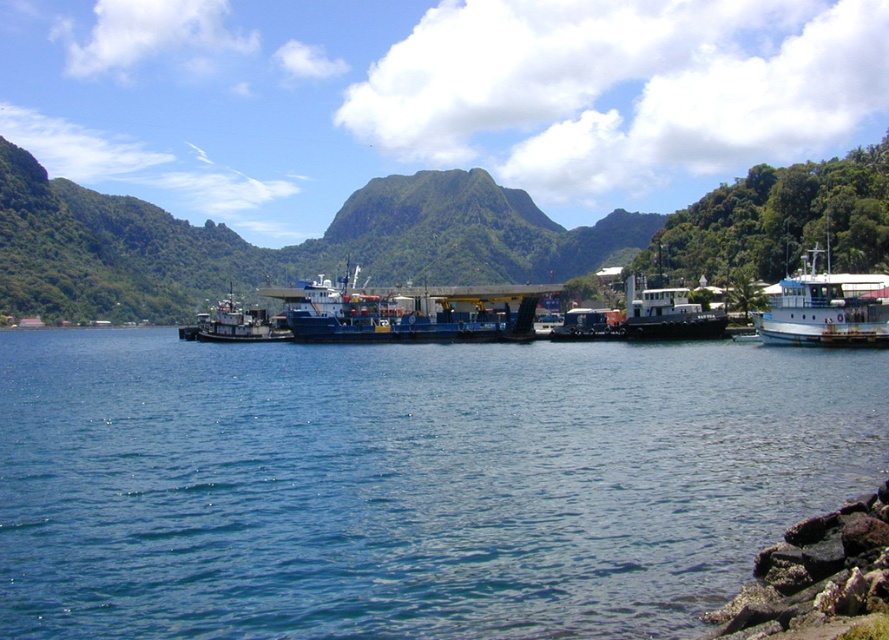
You are a tour guide pointing out two boats to your group. You mention the blue matte cargo ship at center and the white matte boat at right. Which boat is positioned farther to the east?

The white matte boat at right is positioned farther to the east because it is to the right of the blue matte cargo ship at center.

You are standing on the beach and see the blue water at lower left and the blue matte cargo ship at center. Which object is nearer to you?

The blue water at lower left is closer to the viewer than the blue matte cargo ship at center.

You are a photographer planning to capture the green leafy mountain at upper center and the blue matte tugboat at center in a single shot. Considering their sizes, which object will occupy more space in your photo?

The green leafy mountain at upper center will occupy more space in the photo because it has a larger size compared to the blue matte tugboat at center.